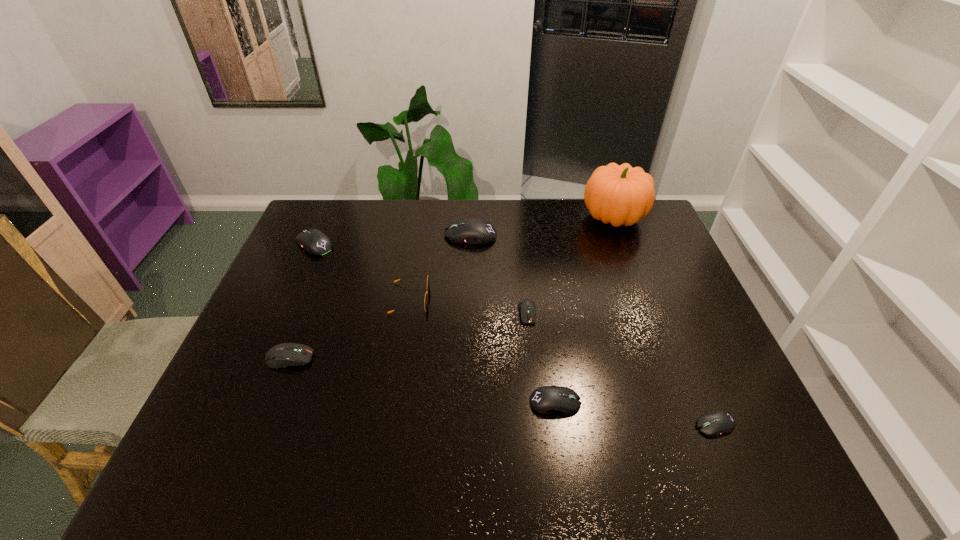
I want to click on free space located on the button of the third farthest computer equipment, so click(x=539, y=418).

Identify the location of free space located 0.130m on the left of the rightmost computer equipment. This screenshot has width=960, height=540. (637, 425).

Image resolution: width=960 pixels, height=540 pixels. I want to click on pumpkin at the far edge, so click(x=620, y=195).

The width and height of the screenshot is (960, 540). I want to click on pumpkin situated at the right edge, so click(x=620, y=195).

Find the location of a particular element. computer equipment situated at the right edge is located at coordinates (715, 423).

At what (x,y) coordinates should I click in order to perform the action: click on object present at the far left corner. Please return your answer as a coordinate pair (x, y). The image size is (960, 540). Looking at the image, I should click on (315, 242).

Find the location of a particular element. The image size is (960, 540). object that is positioned at the far right corner is located at coordinates (620, 195).

Image resolution: width=960 pixels, height=540 pixels. What are the coordinates of `free space at the far edge of the desktop` in the screenshot? It's located at 430,222.

In the image, there is a desktop. In order to click on free space at the near edge in this screenshot , I will do `click(336, 462)`.

In the image, there is a desktop. Identify the location of blank space at the left edge. Image resolution: width=960 pixels, height=540 pixels. (250, 330).